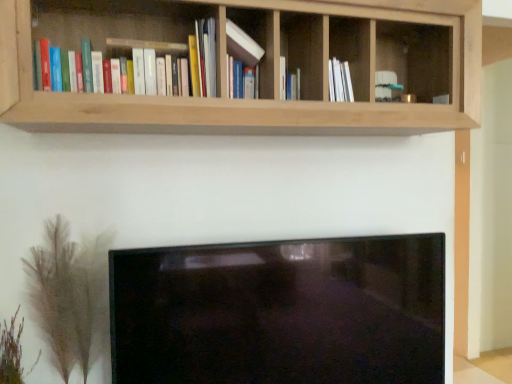
What do you see at coordinates (246, 66) in the screenshot? I see `natural wood shelf at upper center` at bounding box center [246, 66].

How much space does green fuzzy plant at lower left, the second plant in the left-to-right sequence, occupy vertically?

It is 18.08 inches.

What is the approximate width of green fuzzy plant at lower left, the second plant in the left-to-right sequence?

The width of green fuzzy plant at lower left, the second plant in the left-to-right sequence, is 8.28 inches.

Find the location of a particular element. hardcover books at upper left, which is the second book in right-to-left order is located at coordinates (147, 40).

Is natural wood shelf at upper center looking in the opposite direction of green fuzzy plant at lower left, acting as the first plant starting from the right?

No, natural wood shelf at upper center is not facing away from green fuzzy plant at lower left, acting as the first plant starting from the right.

Between natural wood shelf at upper center and green fuzzy plant at lower left, the second plant in the left-to-right sequence, which one has larger size?

With larger size is natural wood shelf at upper center.

Considering the positions of point (354, 34) and point (61, 218), is point (354, 34) closer or farther from the camera than point (61, 218)?

Point (354, 34).

How far apart are natural wood shelf at upper center and green fuzzy plant at lower left, acting as the first plant starting from the right?

natural wood shelf at upper center and green fuzzy plant at lower left, acting as the first plant starting from the right, are 26.65 inches apart from each other.

Can you confirm if green feathery plant at lower left, which ranks as the first plant in left-to-right order, is positioned to the right of natural wood shelf at upper center?

Incorrect, green feathery plant at lower left, which ranks as the first plant in left-to-right order, is not on the right side of natural wood shelf at upper center.

Can you confirm if green feathery plant at lower left, which ranks as the first plant in left-to-right order, is wider than natural wood shelf at upper center?

No, green feathery plant at lower left, which ranks as the first plant in left-to-right order, is not wider than natural wood shelf at upper center.

From a real-world perspective, is green feathery plant at lower left, which ranks as the first plant in left-to-right order, below natural wood shelf at upper center?

Indeed, from a real-world perspective, green feathery plant at lower left, which ranks as the first plant in left-to-right order, is positioned beneath natural wood shelf at upper center.

At what (x,y) coordinates should I click in order to perform the action: click on shelf above the green feathery plant at lower left, which appears as the 2th plant when viewed from the right (from a real-world perspective). Please return your answer as a coordinate pair (x, y). Looking at the image, I should click on (246, 66).

Locate an element on the screen. This screenshot has width=512, height=384. plant above the green feathery plant at lower left, which appears as the 2th plant when viewed from the right (from a real-world perspective) is located at coordinates (68, 294).

Does point (7, 346) appear closer or farther from the camera than point (31, 293)?

Point (7, 346) appears to be closer to the viewer than point (31, 293).

Is green feathery plant at lower left, which ranks as the first plant in left-to-right order, shorter than green fuzzy plant at lower left, the second plant in the left-to-right sequence?

Correct, green feathery plant at lower left, which ranks as the first plant in left-to-right order, is not as tall as green fuzzy plant at lower left, the second plant in the left-to-right sequence.

Is green feathery plant at lower left, which ranks as the first plant in left-to-right order, with green fuzzy plant at lower left, the second plant in the left-to-right sequence?

No.

What's the angular difference between hardcover books at upper left, which is the second book in right-to-left order, and matte white book at center, which ranks as the 2th book in left-to-right order,'s facing directions?

They differ by 0.000291 degrees in their facing directions.

Are hardcover books at upper left, which is the second book in right-to-left order, and matte white book at center, which is the first book from right to left, beside each other?

No, hardcover books at upper left, which is the second book in right-to-left order, is not next to matte white book at center, which is the first book from right to left.

Is hardcover books at upper left, the 1th book viewed from the left, bigger or smaller than matte white book at center, which ranks as the 2th book in left-to-right order?

hardcover books at upper left, the 1th book viewed from the left, is bigger than matte white book at center, which ranks as the 2th book in left-to-right order.

Between hardcover books at upper left, the 1th book viewed from the left, and matte white book at center, which ranks as the 2th book in left-to-right order, which one has less height?

hardcover books at upper left, the 1th book viewed from the left.

What's the angular difference between green feathery plant at lower left, which appears as the 2th plant when viewed from the right, and matte white book at center, which ranks as the 2th book in left-to-right order,'s facing directions?

green feathery plant at lower left, which appears as the 2th plant when viewed from the right, and matte white book at center, which ranks as the 2th book in left-to-right order, are facing 4.55 degrees away from each other.

From the image's perspective, which object appears higher, green feathery plant at lower left, which appears as the 2th plant when viewed from the right, or matte white book at center, which ranks as the 2th book in left-to-right order?

matte white book at center, which ranks as the 2th book in left-to-right order, appears higher in the image.

Is green feathery plant at lower left, which ranks as the first plant in left-to-right order, facing towards matte white book at center, which ranks as the 2th book in left-to-right order?

No, green feathery plant at lower left, which ranks as the first plant in left-to-right order, is not turned towards matte white book at center, which ranks as the 2th book in left-to-right order.

Which is more to the right, green feathery plant at lower left, which appears as the 2th plant when viewed from the right, or hardcover books at upper left, which is the second book in right-to-left order?

hardcover books at upper left, which is the second book in right-to-left order, is more to the right.

Considering the relative sizes of green feathery plant at lower left, which appears as the 2th plant when viewed from the right, and hardcover books at upper left, the 1th book viewed from the left, in the image provided, is green feathery plant at lower left, which appears as the 2th plant when viewed from the right, shorter than hardcover books at upper left, the 1th book viewed from the left,?

Yes, green feathery plant at lower left, which appears as the 2th plant when viewed from the right, is shorter than hardcover books at upper left, the 1th book viewed from the left.

Who is bigger, green feathery plant at lower left, which appears as the 2th plant when viewed from the right, or hardcover books at upper left, the 1th book viewed from the left?

With larger size is hardcover books at upper left, the 1th book viewed from the left.

Is green feathery plant at lower left, which ranks as the first plant in left-to-right order, not inside hardcover books at upper left, which is the second book in right-to-left order?

Indeed, green feathery plant at lower left, which ranks as the first plant in left-to-right order, is completely outside hardcover books at upper left, which is the second book in right-to-left order.

Locate an element on the screen. This screenshot has width=512, height=384. plant lying below the green fuzzy plant at lower left, acting as the first plant starting from the right (from the image's perspective) is located at coordinates (12, 352).

From a real-world perspective, between green fuzzy plant at lower left, the second plant in the left-to-right sequence, and green feathery plant at lower left, which ranks as the first plant in left-to-right order, who is vertically lower?

green feathery plant at lower left, which ranks as the first plant in left-to-right order, is physically lower.

In terms of width, does green fuzzy plant at lower left, the second plant in the left-to-right sequence, look wider or thinner when compared to green feathery plant at lower left, which appears as the 2th plant when viewed from the right?

In the image, green fuzzy plant at lower left, the second plant in the left-to-right sequence, appears to be wider than green feathery plant at lower left, which appears as the 2th plant when viewed from the right.

This screenshot has width=512, height=384. I want to click on the 1st plant to the left of the natural wood shelf at upper center, counting from the anchor's position, so click(68, 294).

From a real-world perspective, which plant is the 2nd one underneath the natural wood shelf at upper center? Please provide its 2D coordinates.

[(12, 352)]

Considering their positions, is matte white book at center, which ranks as the 2th book in left-to-right order, positioned closer to natural wood shelf at upper center than green feathery plant at lower left, which ranks as the first plant in left-to-right order?

Based on the image, matte white book at center, which ranks as the 2th book in left-to-right order, appears to be nearer to natural wood shelf at upper center.

Based on the photo, when comparing their distances from matte white book at center, which ranks as the 2th book in left-to-right order, does hardcover books at upper left, the 1th book viewed from the left, or green fuzzy plant at lower left, the second plant in the left-to-right sequence, seem closer?

The object closer to matte white book at center, which ranks as the 2th book in left-to-right order, is hardcover books at upper left, the 1th book viewed from the left.

Which object lies nearer to the anchor point matte white book at center, which ranks as the 2th book in left-to-right order, natural wood shelf at upper center or green fuzzy plant at lower left, acting as the first plant starting from the right?

natural wood shelf at upper center.

Considering their positions, is hardcover books at upper left, the 1th book viewed from the left, positioned further to matte white book at center, which is the first book from right to left, than natural wood shelf at upper center?

The object further to matte white book at center, which is the first book from right to left, is natural wood shelf at upper center.

Which object lies nearer to the anchor point hardcover books at upper left, which is the second book in right-to-left order, green fuzzy plant at lower left, the second plant in the left-to-right sequence, or natural wood shelf at upper center?

Based on the image, natural wood shelf at upper center appears to be nearer to hardcover books at upper left, which is the second book in right-to-left order.

When comparing their distances from green feathery plant at lower left, which ranks as the first plant in left-to-right order, does hardcover books at upper left, the 1th book viewed from the left, or green fuzzy plant at lower left, acting as the first plant starting from the right, seem further?

hardcover books at upper left, the 1th book viewed from the left, is further to green feathery plant at lower left, which ranks as the first plant in left-to-right order.

Considering their positions, is natural wood shelf at upper center positioned closer to green fuzzy plant at lower left, acting as the first plant starting from the right, than hardcover books at upper left, the 1th book viewed from the left?

Based on the image, hardcover books at upper left, the 1th book viewed from the left, appears to be nearer to green fuzzy plant at lower left, acting as the first plant starting from the right.

Looking at the image, which one is located closer to green feathery plant at lower left, which appears as the 2th plant when viewed from the right, green fuzzy plant at lower left, acting as the first plant starting from the right, or hardcover books at upper left, which is the second book in right-to-left order?

green fuzzy plant at lower left, acting as the first plant starting from the right, is closer to green feathery plant at lower left, which appears as the 2th plant when viewed from the right.

In order to click on plant between hardcover books at upper left, which is the second book in right-to-left order, and green feathery plant at lower left, which ranks as the first plant in left-to-right order, vertically in this screenshot , I will do `click(68, 294)`.

Locate an element on the screen. Image resolution: width=512 pixels, height=384 pixels. plant between natural wood shelf at upper center and green feathery plant at lower left, which appears as the 2th plant when viewed from the right, from top to bottom is located at coordinates (68, 294).

Find the location of a particular element. Image resolution: width=512 pixels, height=384 pixels. plant between matte white book at center, which ranks as the 2th book in left-to-right order, and green feathery plant at lower left, which ranks as the first plant in left-to-right order, from top to bottom is located at coordinates (68, 294).

Image resolution: width=512 pixels, height=384 pixels. In order to click on book between matte white book at center, which ranks as the 2th book in left-to-right order, and green fuzzy plant at lower left, the second plant in the left-to-right sequence, in the vertical direction in this screenshot , I will do `click(147, 40)`.